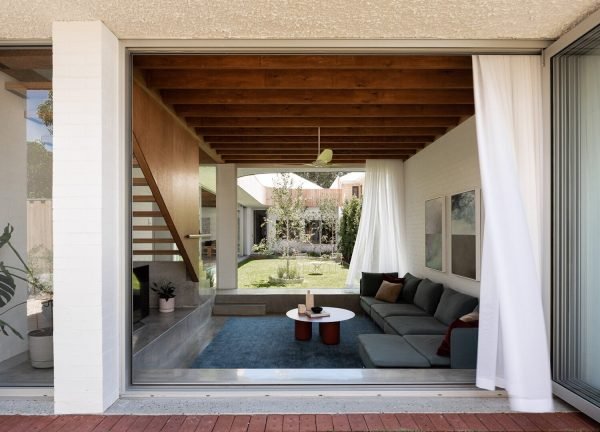
Identify the location of sofa. This screenshot has width=600, height=432. (413, 321).